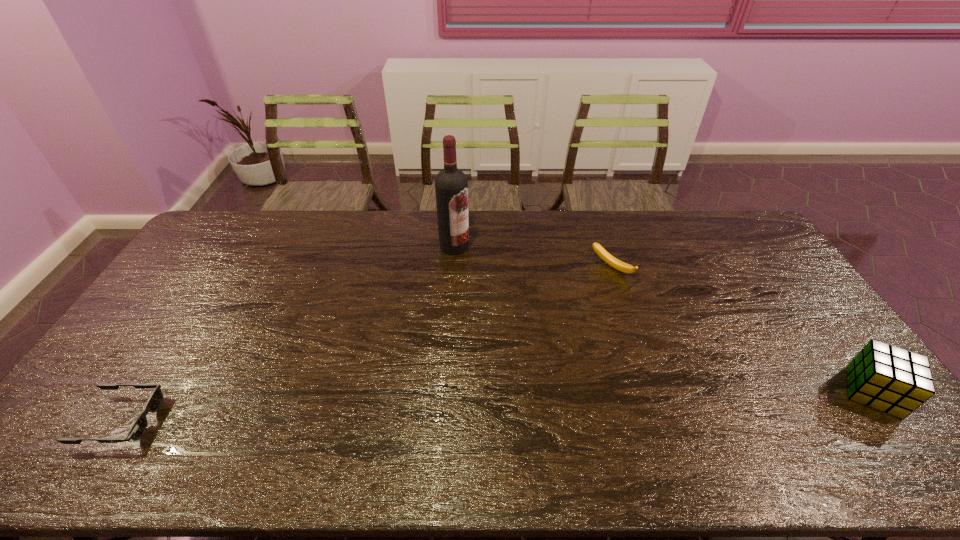
Image resolution: width=960 pixels, height=540 pixels. I want to click on vacant area located on the label of the third object from right to left, so click(x=478, y=269).

Where is `free space located on the label of the third object from right to left`? free space located on the label of the third object from right to left is located at coordinates (470, 261).

Where is `free point located 0.100m on the label of the third object from right to left`? The width and height of the screenshot is (960, 540). free point located 0.100m on the label of the third object from right to left is located at coordinates (478, 269).

Locate an element on the screen. Image resolution: width=960 pixels, height=540 pixels. vacant space located 0.230m at the stem of the banana is located at coordinates (561, 315).

Find the location of `vacant space positioned at the stem of the banana`. vacant space positioned at the stem of the banana is located at coordinates (534, 338).

I want to click on vacant region located at the stem of the banana, so click(527, 344).

The height and width of the screenshot is (540, 960). In order to click on object located in the far edge section of the desktop in this screenshot , I will do `click(451, 186)`.

The image size is (960, 540). What are the coordinates of `sunglasses located in the near edge section of the desktop` in the screenshot? It's located at (139, 427).

Locate an element on the screen. Image resolution: width=960 pixels, height=540 pixels. cube positioned at the near edge is located at coordinates (887, 378).

Locate an element on the screen. object that is at the left edge is located at coordinates (139, 427).